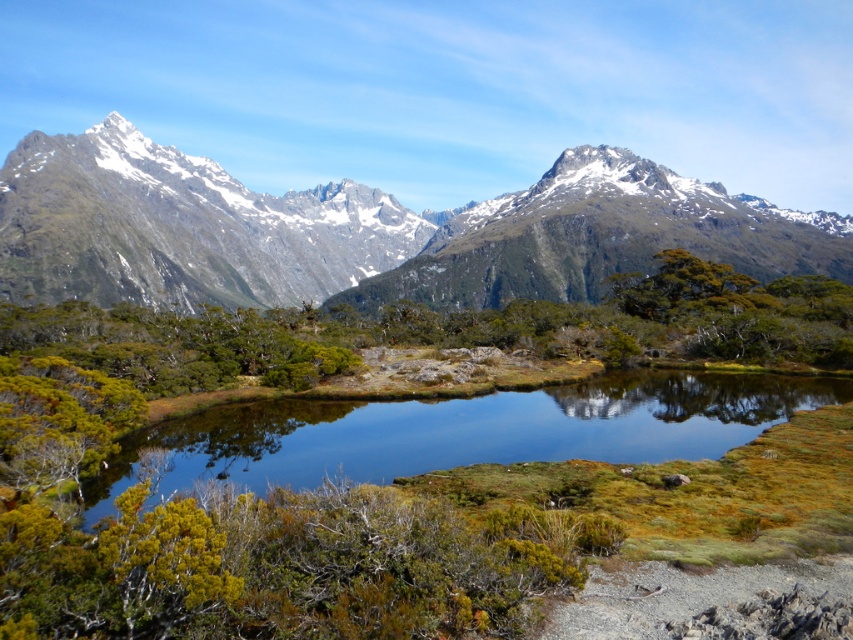
Question: Does snowy rock mountain range at upper center appear under green grassy water at center?

Choices:
 (A) no
 (B) yes

Answer: (A)

Question: Which of the following is the closest to the observer?

Choices:
 (A) (650, 372)
 (B) (111, 120)

Answer: (A)

Question: In this image, where is snowy rock mountain range at upper center located relative to green grassy water at center?

Choices:
 (A) right
 (B) left

Answer: (B)

Question: Which point appears farthest from the camera in this image?

Choices:
 (A) (578, 388)
 (B) (210, 184)

Answer: (B)

Question: Among these objects, which one is nearest to the camera?

Choices:
 (A) green grassy water at center
 (B) snowy rock mountain range at upper center

Answer: (A)

Question: Can you confirm if snowy rock mountain range at upper center is positioned above green grassy water at center?

Choices:
 (A) yes
 (B) no

Answer: (A)